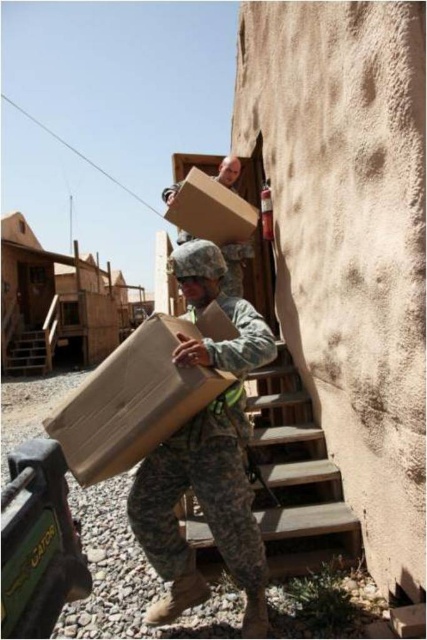
You are a photographer at the desert military base. You want to capture a photo of the camouflage fabric soldier at center and the brown cardboard box at center. Based on their positions, which object is closer to the camera?

The camouflage fabric soldier at center is located below the brown cardboard box at center, meaning the soldier is closer to the camera than the box.

You are a photographer trying to capture the scene of the two soldiers carrying boxes up the stairs. You want to ensure that both the camouflage fabric soldier at center and the brown cardboard box at center are clearly visible in your photo. Considering their sizes, which object should you focus on to ensure it doesn t get lost in the frame?

The camouflage fabric soldier at center has a lesser width compared to the brown cardboard box at center, so you should focus on the smaller soldier to ensure it doesn t get lost next to the larger box.

You are a drone operator tasked with delivering a package to the brown cardboard box at center. Based on the coordinates provided in the Objects Description, what are the exact coordinates where you should aim the drone to drop the package?

The exact coordinates to aim the drone are at point (137, 396) as specified in the Objects Description.